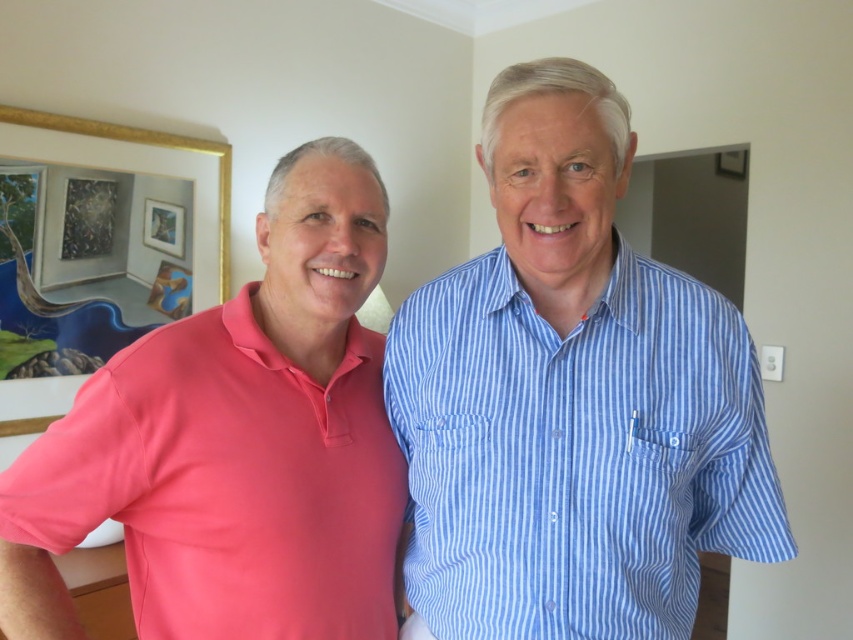
Based on the photo, you are a photographer trying to capture the matte pink polo shirt at left. What are the coordinates where you should focus your camera?

The coordinates to focus on are (235,444) to capture the matte pink polo shirt at left.